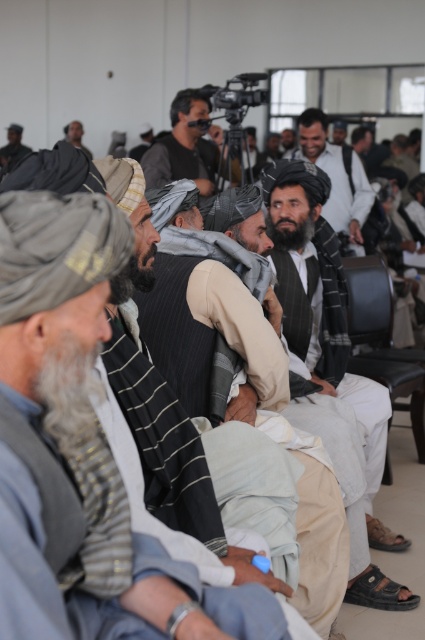
Looking at this image, you are a photographer who wants to take a photo of the group of men seated in the formal gathering. You have a matte black camera at center. Where exactly should you position your camera to capture the entire group in the frame?

The matte black camera at center should be positioned at point (x=184, y=145) to capture the entire group in the frame.